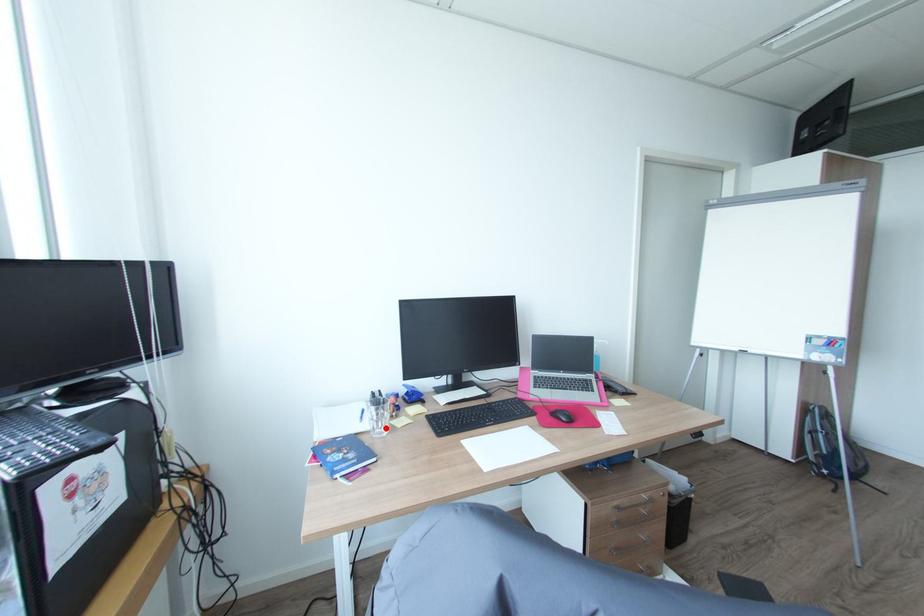
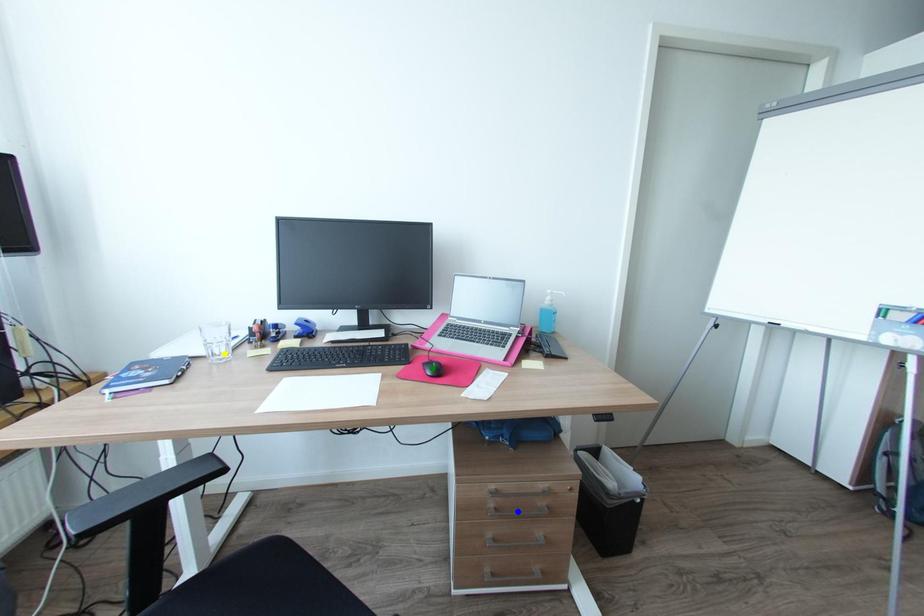
Question: I am providing you with two images of the same scene from different viewpoints. A red point is marked on the first image. You are given multiple points on the second image. Can you choose the point in image 2 that corresponds to the point in image 1?

Choices:
 (A) yellow point
 (B) green point
 (C) blue point

Answer: (A)